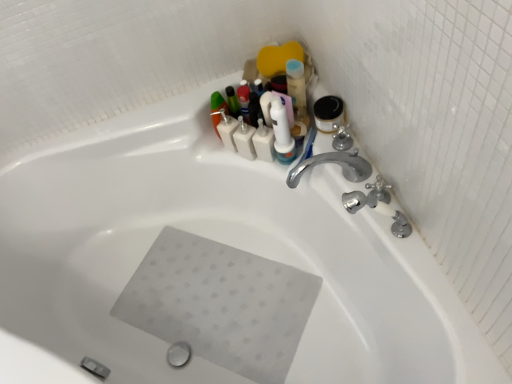
Question: From a real-world perspective, is satin nickel faucet at upper right, which is the 2th plumbing fixture from front to back, located beneath white plastic toothbrush at upper center, which is the first toiletry from right to left?

Choices:
 (A) no
 (B) yes

Answer: (A)

Question: Can you confirm if satin nickel faucet at upper right, which is the 2th plumbing fixture from front to back, is positioned to the left of white plastic toothbrush at upper center, the 2th toiletry when ordered from left to right?

Choices:
 (A) yes
 (B) no

Answer: (B)

Question: Is satin nickel faucet at upper right, which is the 2th plumbing fixture from front to back, bigger than white plastic toothbrush at upper center, which is the first toiletry from right to left?

Choices:
 (A) yes
 (B) no

Answer: (B)

Question: Is the position of satin nickel faucet at upper right, the 1th plumbing fixture when ordered from back to front, less distant than that of white plastic toothbrush at upper center, the 2th toiletry when ordered from left to right?

Choices:
 (A) no
 (B) yes

Answer: (B)

Question: Could white plastic toothbrush at upper center, the 2th toiletry when ordered from left to right, be considered to be inside satin nickel faucet at upper right, the 1th plumbing fixture when ordered from back to front?

Choices:
 (A) no
 (B) yes

Answer: (A)

Question: In terms of height, does satin nickel faucet at upper right, which is the 2th plumbing fixture from front to back, look taller or shorter compared to white plastic toothbrush at upper center, which is the first toiletry from right to left?

Choices:
 (A) short
 (B) tall

Answer: (A)

Question: In terms of size, does satin nickel faucet at upper right, which is the 2th plumbing fixture from front to back, appear bigger or smaller than white plastic toothbrush at upper center, which is the first toiletry from right to left?

Choices:
 (A) small
 (B) big

Answer: (A)

Question: From a real-world perspective, is satin nickel faucet at upper right, which is the 2th plumbing fixture from front to back, physically located above or below white plastic toothbrush at upper center, which is the first toiletry from right to left?

Choices:
 (A) above
 (B) below

Answer: (A)

Question: Considering their positions, is satin nickel faucet at upper right, the 1th plumbing fixture when ordered from back to front, located in front of or behind white plastic toothbrush at upper center, the 2th toiletry when ordered from left to right?

Choices:
 (A) behind
 (B) front

Answer: (B)

Question: From a real-world perspective, is white matte bottles at upper center, marked as the first toiletry in a left-to-right arrangement, physically located above or below silver metallic faucet at upper right, which ranks as the first plumbing fixture in front-to-back order?

Choices:
 (A) above
 (B) below

Answer: (B)

Question: Based on their sizes in the image, would you say white matte bottles at upper center, marked as the first toiletry in a left-to-right arrangement, is bigger or smaller than silver metallic faucet at upper right, the second plumbing fixture positioned from the back?

Choices:
 (A) big
 (B) small

Answer: (B)

Question: Considering their positions, is white matte bottles at upper center, which appears as the 2th toiletry when viewed from the right, located in front of or behind silver metallic faucet at upper right, the second plumbing fixture positioned from the back?

Choices:
 (A) behind
 (B) front

Answer: (A)

Question: Considering the positions of white matte bottles at upper center, marked as the first toiletry in a left-to-right arrangement, and silver metallic faucet at upper right, the second plumbing fixture positioned from the back, in the image, is white matte bottles at upper center, marked as the first toiletry in a left-to-right arrangement, taller or shorter than silver metallic faucet at upper right, the second plumbing fixture positioned from the back,?

Choices:
 (A) short
 (B) tall

Answer: (A)

Question: In terms of size, does satin nickel faucet at upper right, which is the 2th plumbing fixture from front to back, appear bigger or smaller than silver metallic faucet at upper right, the second plumbing fixture positioned from the back?

Choices:
 (A) small
 (B) big

Answer: (A)

Question: Considering their positions, is satin nickel faucet at upper right, the 1th plumbing fixture when ordered from back to front, located in front of or behind silver metallic faucet at upper right, which ranks as the first plumbing fixture in front-to-back order?

Choices:
 (A) front
 (B) behind

Answer: (B)